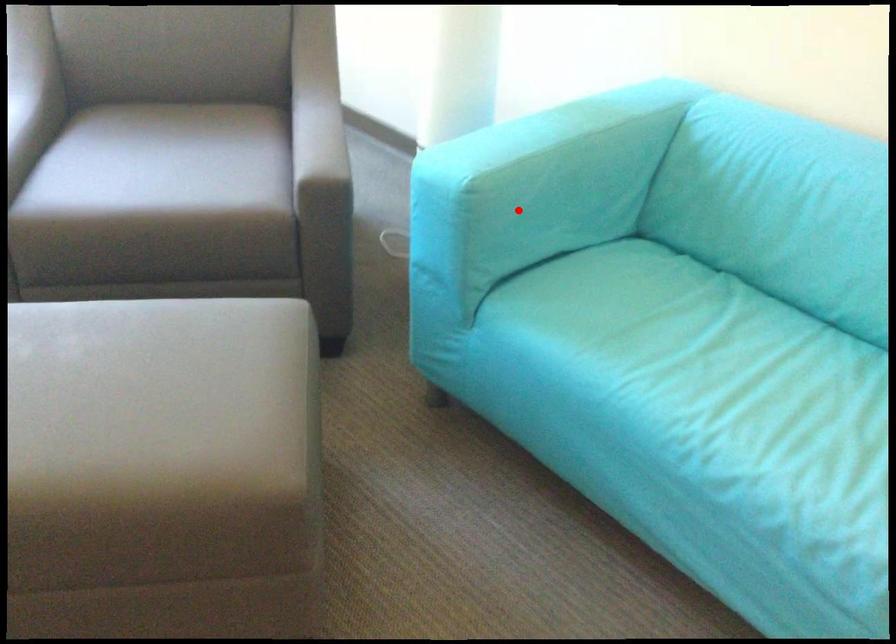
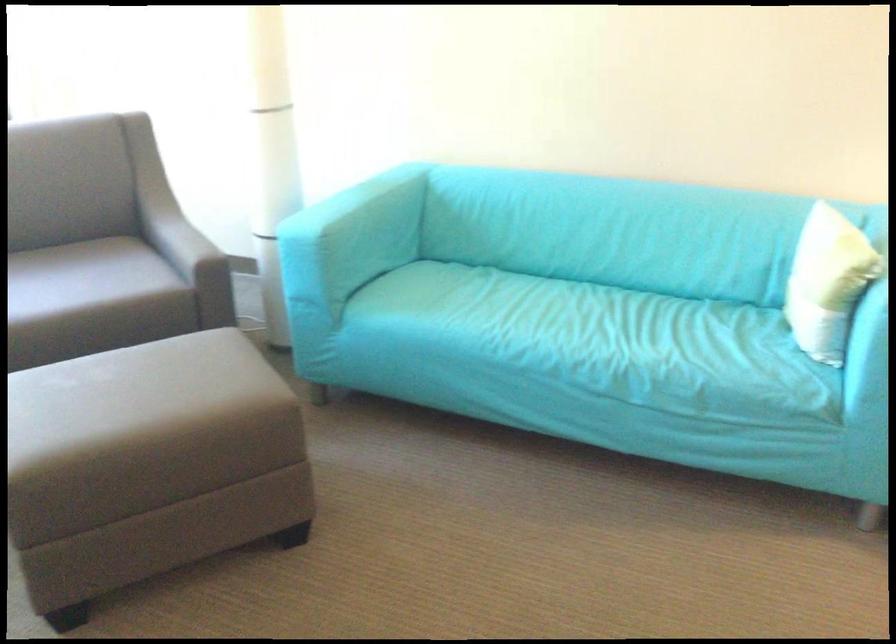
Find the pixel in the second image that matches the highlighted location in the first image.

(340, 242)